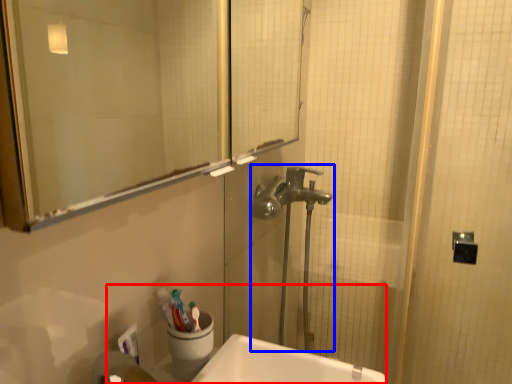
Question: Which of the following is the farthest to the observer, sink (highlighted by a red box) or plumbing fixture (highlighted by a blue box)?

Choices:
 (A) sink
 (B) plumbing fixture

Answer: (B)